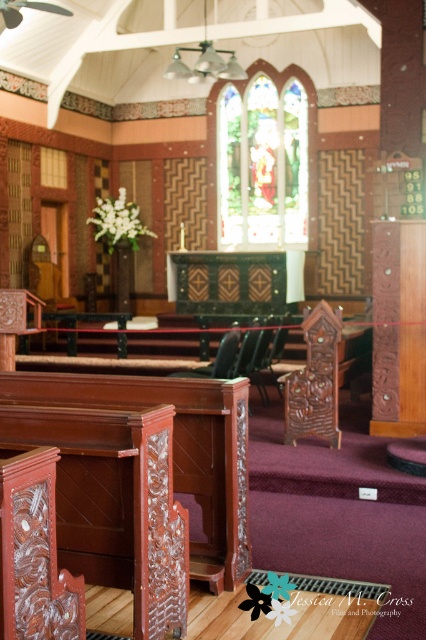
You are standing at the entrance of the church and notice the stained glass at center and the wooden carved chair at center. Which object is positioned to the right when facing the altar?

The stained glass at center is to the right of the wooden carved chair at center when facing the altar.

Based on the photo, you are planning to take a photo of the stained glass at center and the wooden carved chair at center in the church. Which object should you focus on first if you want to capture both in a single frame without moving the camera?

The stained glass at center is bigger than the wooden carved chair at center, so you should focus on the stained glass at center first to ensure it fits properly in the frame.

You are standing at the entrance of the church and want to sit in the wooden carved chair at center. Can you see the stained glass at center from your seat?

The wooden carved chair at center is behind stained glass at center, so when you sit in the wooden carved chair at center, you would be facing away from the stained glass at center. Therefore, you cannot see the stained glass at center from your seat.